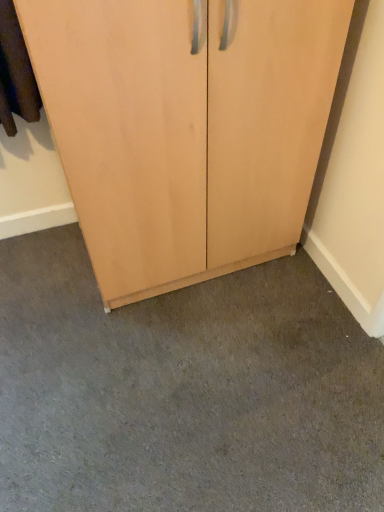
The width and height of the screenshot is (384, 512). In order to click on vacant area that lies in front of light wood cupboard at center in this screenshot , I will do `click(189, 378)`.